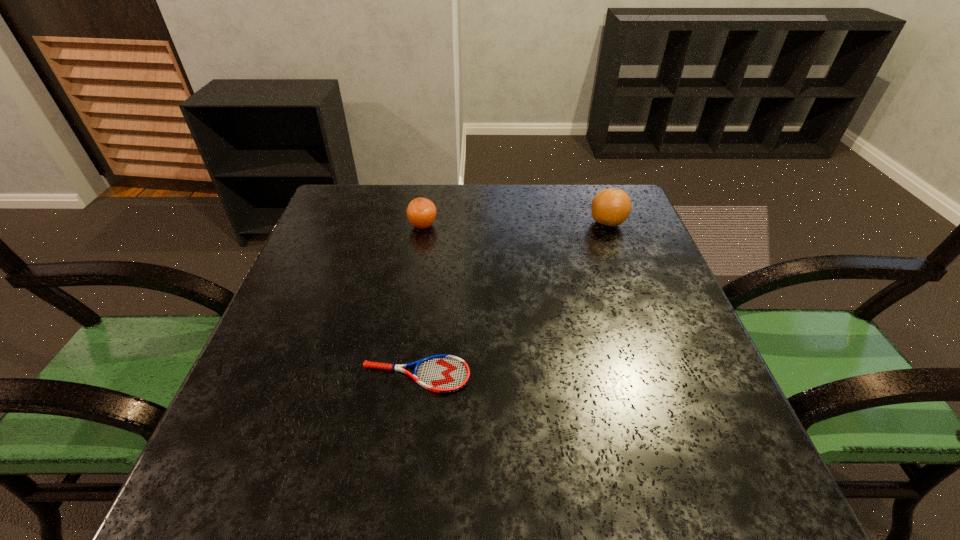
Identify the location of blank space that satisfies the following two spatial constraints: 1. on the front side of the nearest object; 2. on the left side of the second shortest object. This screenshot has width=960, height=540. (398, 375).

This screenshot has width=960, height=540. In order to click on free spot that satisfies the following two spatial constraints: 1. on the back side of the shortest object; 2. on the left side of the tallest object in this screenshot , I will do click(x=436, y=223).

Identify the location of blank space that satisfies the following two spatial constraints: 1. on the front side of the nearest object; 2. on the left side of the shorter orange. (398, 375).